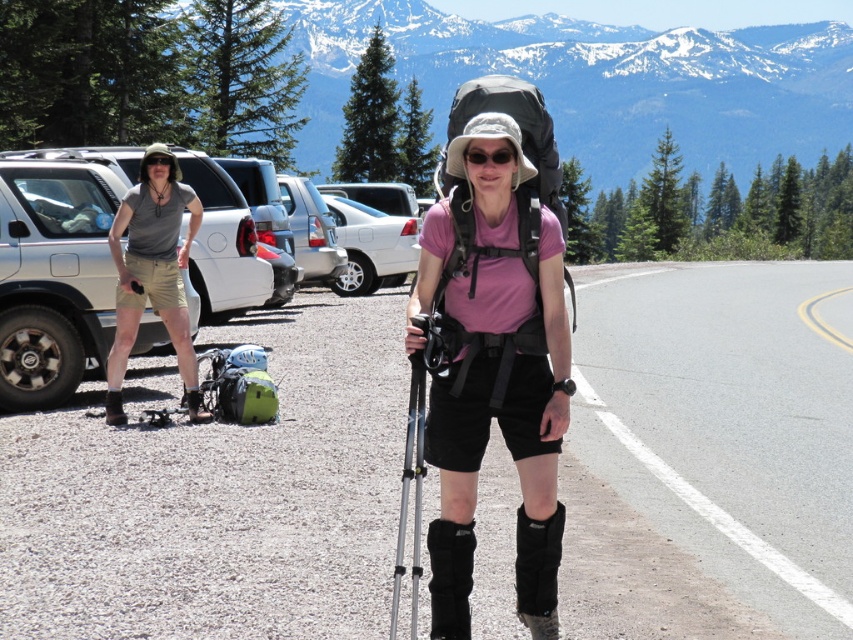
Question: Does black suede boot at lower left have a greater width compared to black matte goggles at upper left?

Choices:
 (A) yes
 (B) no

Answer: (B)

Question: Which object is positioned closest to the matte gray shirt at left?

Choices:
 (A) gray asphalt parking lot at center
 (B) black fabric boot at lower center
 (C) silver metallic suv at left

Answer: (C)

Question: Which of the following is the closest to the observer?

Choices:
 (A) white matte car at center
 (B) black rubber boot at lower left
 (C) matte gray shirt at left
 (D) black matte sunglasses at center

Answer: (D)

Question: Can you confirm if black fabric boot at lower center is thinner than black matte sunglasses at center?

Choices:
 (A) yes
 (B) no

Answer: (B)

Question: Which of the following is the farthest from the observer?

Choices:
 (A) gray asphalt parking lot at center
 (B) black matte goggles at upper left
 (C) matte gray shirt at left
 (D) silver metallic ski pole at center

Answer: (B)

Question: Does silver metallic suv at left come behind black synthetic boot at lower center?

Choices:
 (A) yes
 (B) no

Answer: (A)